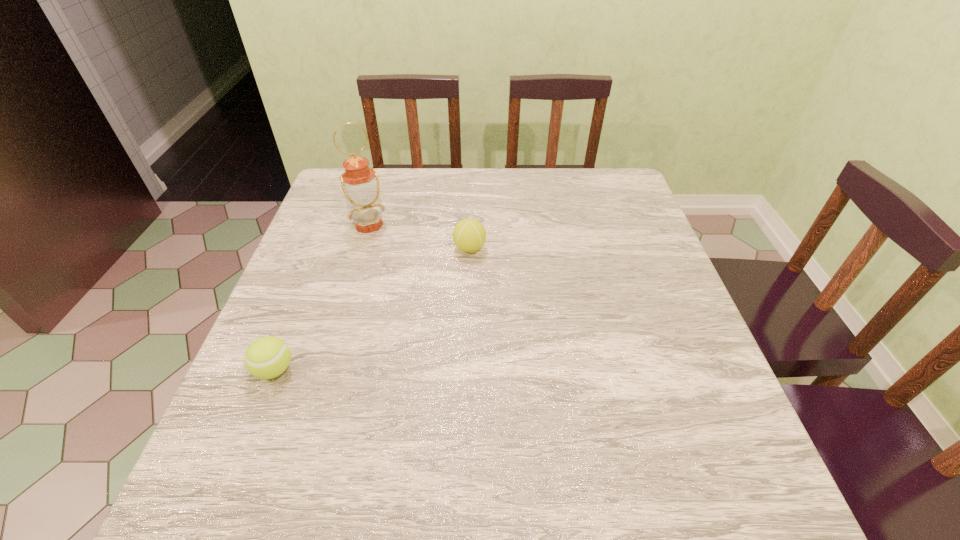
At what (x,y) coordinates should I click in order to perform the action: click on vacant area between the farthest object and the second farthest object. Please return your answer as a coordinate pair (x, y). The image size is (960, 540). Looking at the image, I should click on (420, 237).

Locate an element on the screen. Image resolution: width=960 pixels, height=540 pixels. free spot between the left tennis ball and the farthest object is located at coordinates (322, 298).

The width and height of the screenshot is (960, 540). What are the coordinates of `free spot between the tallest object and the nearest object` in the screenshot? It's located at (322, 298).

This screenshot has width=960, height=540. Identify the location of blank region between the nearest object and the farther tennis ball. (372, 309).

Identify the location of free space between the right tennis ball and the nearer tennis ball. (372, 309).

Locate an element on the screen. This screenshot has height=540, width=960. object that is the closest to the farther tennis ball is located at coordinates (360, 184).

Image resolution: width=960 pixels, height=540 pixels. In order to click on object that is the second closest to the oil lamp in this screenshot , I will do [267, 357].

The width and height of the screenshot is (960, 540). What are the coordinates of `free location that satisfies the following two spatial constraints: 1. on the back side of the leftmost object; 2. on the right side of the farthest object` in the screenshot? It's located at 332,225.

Find the location of a particular element. This screenshot has width=960, height=540. vacant point that satisfies the following two spatial constraints: 1. on the back side of the leftmost object; 2. on the right side of the second farthest object is located at coordinates (323, 248).

Find the location of a particular element. Image resolution: width=960 pixels, height=540 pixels. free space that satisfies the following two spatial constraints: 1. on the back side of the second nearest object; 2. on the right side of the nearer tennis ball is located at coordinates (323, 248).